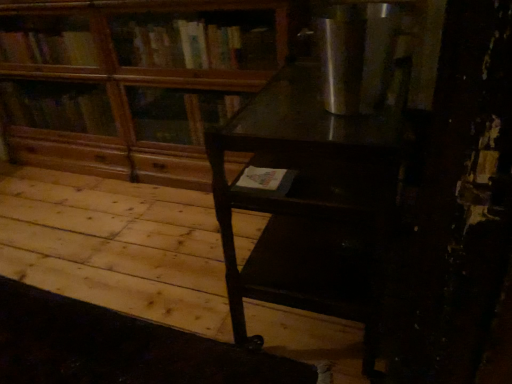
Question: From the image's perspective, is dark wood table at center positioned above or below wooden bookcase at center?

Choices:
 (A) below
 (B) above

Answer: (A)

Question: Looking at the image, does dark wood table at center seem bigger or smaller compared to wooden bookcase at center?

Choices:
 (A) big
 (B) small

Answer: (B)

Question: From their relative heights in the image, would you say dark wood table at center is taller or shorter than wooden bookcase at center?

Choices:
 (A) short
 (B) tall

Answer: (A)

Question: Considering the positions of wooden bookcase at center and dark wood table at center in the image, is wooden bookcase at center taller or shorter than dark wood table at center?

Choices:
 (A) tall
 (B) short

Answer: (A)

Question: In terms of size, does wooden bookcase at center appear bigger or smaller than dark wood table at center?

Choices:
 (A) small
 (B) big

Answer: (B)

Question: From a real-world perspective, relative to dark wood table at center, is wooden bookcase at center vertically above or below?

Choices:
 (A) below
 (B) above

Answer: (B)

Question: Relative to dark wood table at center, is wooden bookcase at center in front or behind?

Choices:
 (A) front
 (B) behind

Answer: (B)